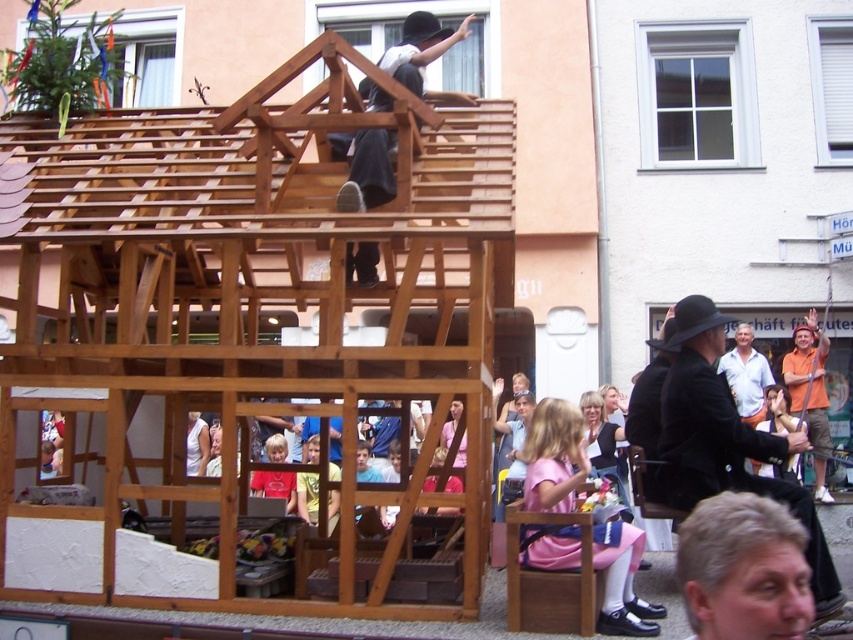
Question: Is black matte hat at center to the left of yellow fabric at lower center from the viewer's perspective?

Choices:
 (A) no
 (B) yes

Answer: (A)

Question: Which of the following is the farthest from the observer?

Choices:
 (A) black matte hat at center
 (B) light brown wooden chair at lower right

Answer: (B)

Question: Which of these objects is positioned closest to the black matte hat at center?

Choices:
 (A) light brown wooden chair at lower right
 (B) natural wood house at upper center
 (C) orange cotton shirt at upper right

Answer: (A)

Question: Can you confirm if gray matte hair at lower right is positioned below yellow fabric at lower center?

Choices:
 (A) yes
 (B) no

Answer: (B)

Question: Which object is the farthest from the natural wood house at upper center?

Choices:
 (A) yellow fabric at lower center
 (B) orange cotton shirt at upper right
 (C) black matte hat at center

Answer: (B)

Question: Does orange cotton shirt at upper right have a larger size compared to light brown wooden chair at lower right?

Choices:
 (A) no
 (B) yes

Answer: (A)